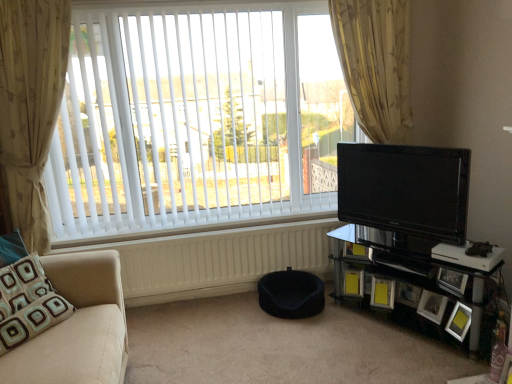
Where is `free location to the left of yellow matte picture frame at lower right, which is the 6th picture frame from right to left`? free location to the left of yellow matte picture frame at lower right, which is the 6th picture frame from right to left is located at coordinates (337, 299).